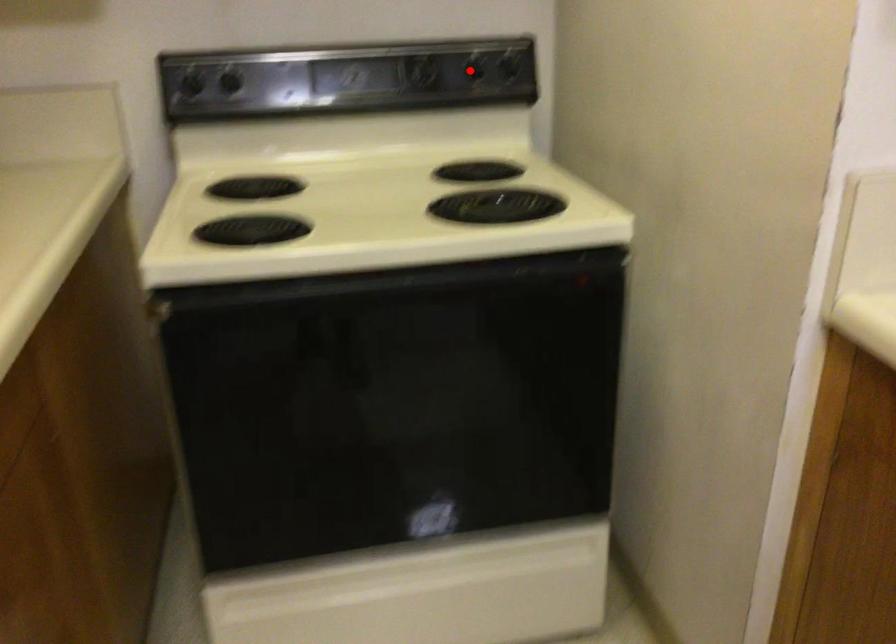
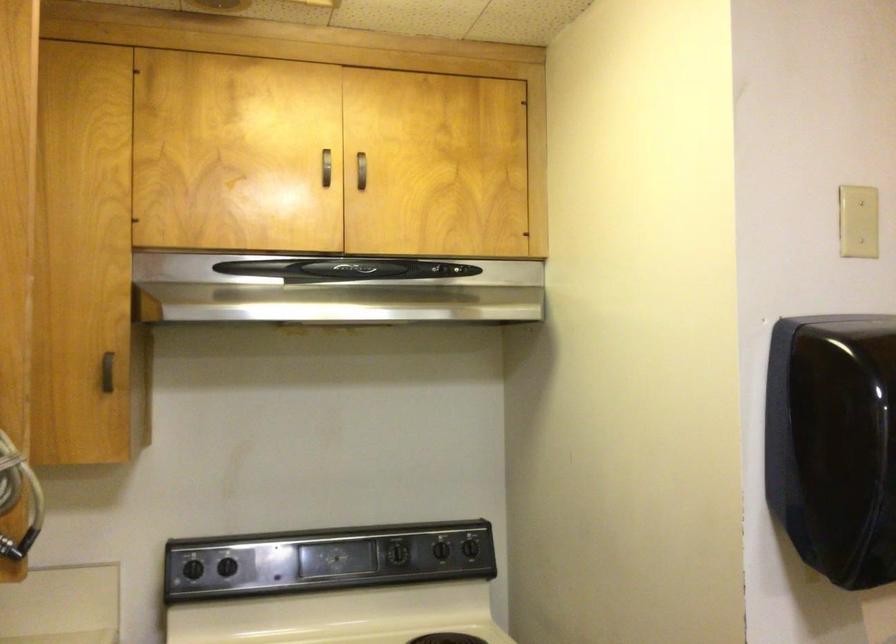
Question: A red point is marked in image1. In image2, is the corresponding 3D point closer to the camera or farther? Reply with the corresponding letter.

Choices:
 (A) The corresponding 3D point is closer.
 (B) The corresponding 3D point is farther.

Answer: (B)